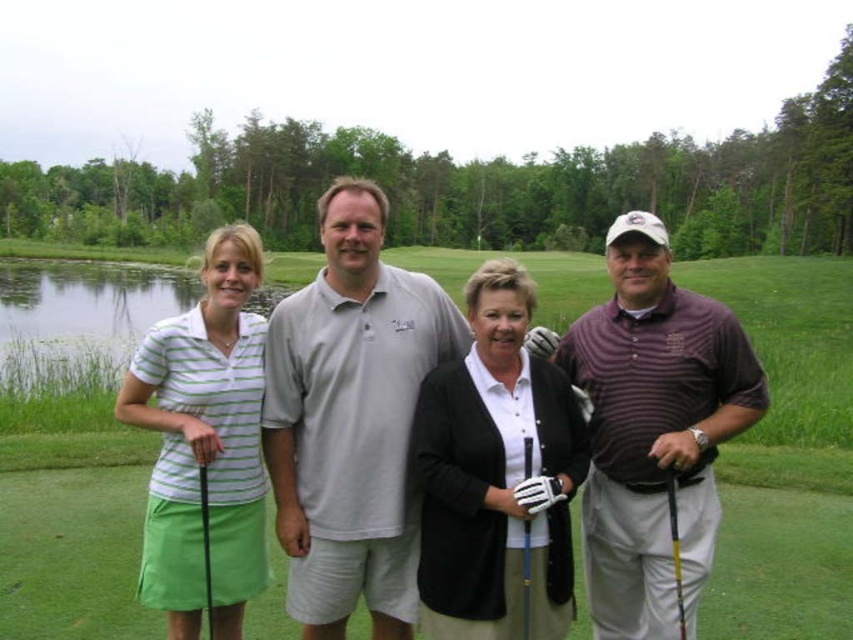
Is striped cotton polo shirt at center thinner than yellow metallic golf club at lower right?

In fact, striped cotton polo shirt at center might be wider than yellow metallic golf club at lower right.

Which is behind, point (643, 344) or point (672, 544)?

Point (643, 344)

Who is more forward, (686, 600) or (672, 570)?

Point (686, 600) is in front.

Where is `striped cotton polo shirt at center`? striped cotton polo shirt at center is located at coordinates (654, 429).

Which is more to the right, gray cotton polo shirt at center or striped cotton polo shirt at center?

From the viewer's perspective, striped cotton polo shirt at center appears more on the right side.

Based on the photo, measure the distance from gray cotton polo shirt at center to striped cotton polo shirt at center.

4.94 feet

Locate an element on the screen. The width and height of the screenshot is (853, 640). gray cotton polo shirt at center is located at coordinates (351, 419).

Which is behind, point (631, 536) or point (442, 612)?

The point (631, 536) is more distant.

Is point (625, 515) farther from camera compared to point (532, 582)?

Yes, it is.

The image size is (853, 640). I want to click on striped cotton polo shirt at center, so click(x=654, y=429).